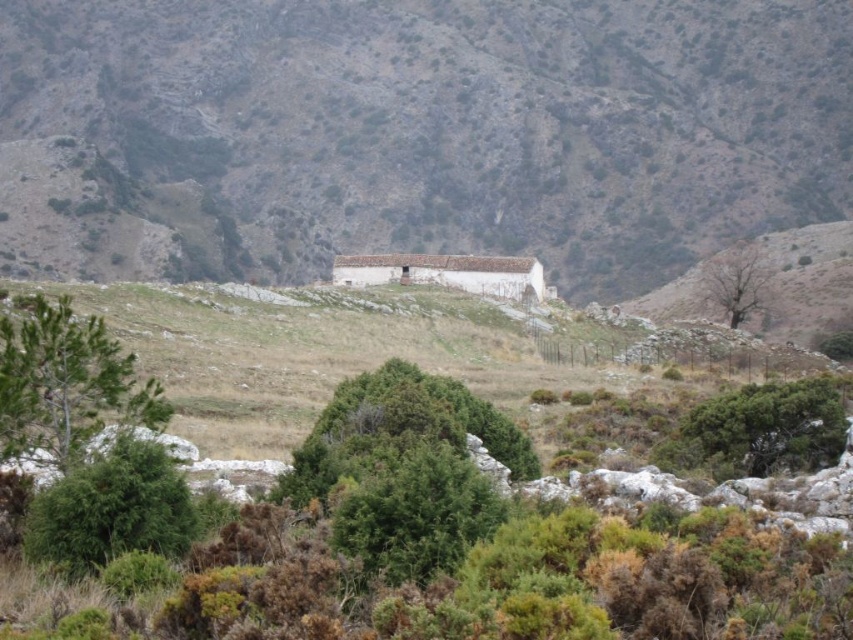
Can you confirm if green leafy tree at center is bigger than green leafy tree at left?

Incorrect, green leafy tree at center is not larger than green leafy tree at left.

How distant is green leafy tree at center from green leafy tree at left?

green leafy tree at center and green leafy tree at left are 10.09 meters apart.

Based on the photo, who is more distant from viewer, (x=370, y=506) or (x=109, y=346)?

The point (x=109, y=346) is more distant.

This screenshot has height=640, width=853. In order to click on green leafy tree at center in this screenshot , I will do `click(405, 468)`.

This screenshot has width=853, height=640. What do you see at coordinates (415, 132) in the screenshot?
I see `brown rocky mountain at center` at bounding box center [415, 132].

Which of these two, brown rocky mountain at center or green leafy tree at center, stands shorter?

green leafy tree at center is shorter.

Where is `brown rocky mountain at center`? This screenshot has height=640, width=853. brown rocky mountain at center is located at coordinates (415, 132).

Does brown rocky mountain at center have a greater width compared to green leafy shrub at lower left?

Indeed, brown rocky mountain at center has a greater width compared to green leafy shrub at lower left.

Where is `brown rocky mountain at center`? This screenshot has width=853, height=640. brown rocky mountain at center is located at coordinates (415, 132).